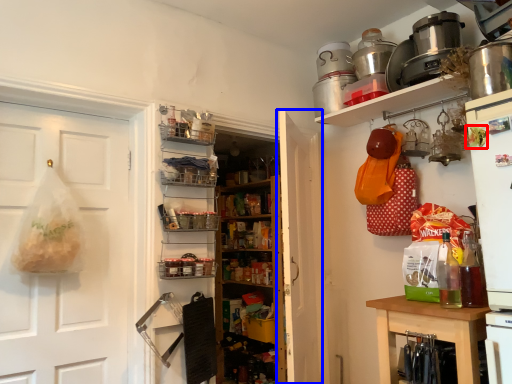
Question: Which point is closer to the camera, food (highlighted by a red box) or door (highlighted by a blue box)?

Choices:
 (A) food
 (B) door

Answer: (A)